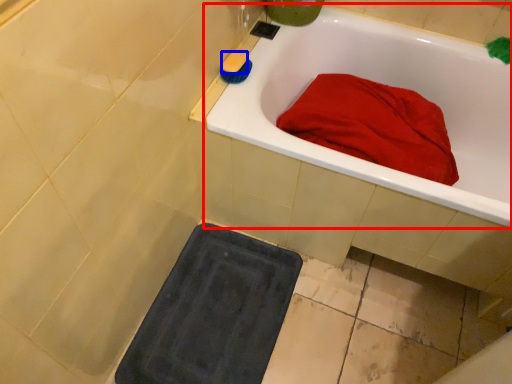
Question: Which point is further to the camera, bathtub (highlighted by a red box) or soap (highlighted by a blue box)?

Choices:
 (A) bathtub
 (B) soap

Answer: (B)